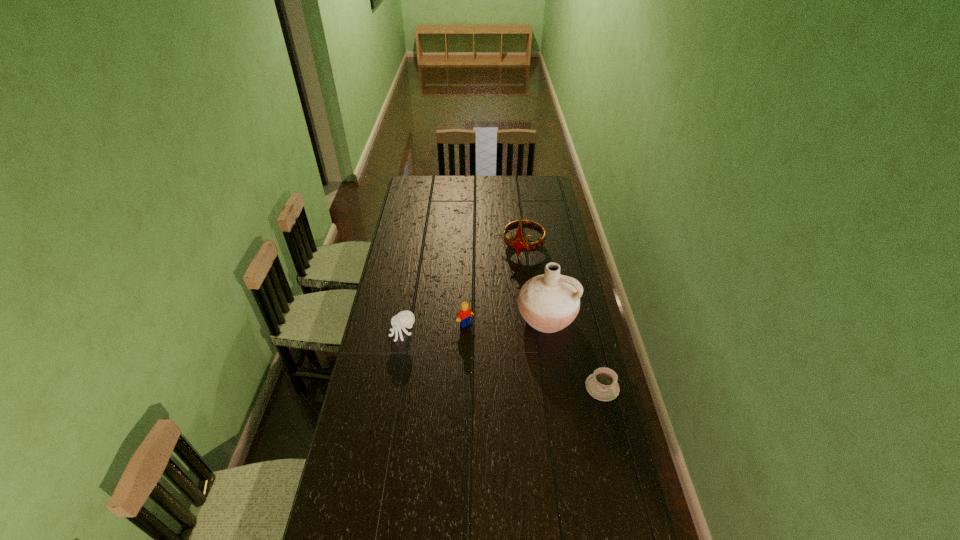
Where is `octopus`? This screenshot has height=540, width=960. octopus is located at coordinates (405, 319).

This screenshot has height=540, width=960. Identify the location of the shortest object. (602, 385).

You are a GUI agent. You are given a task and a screenshot of the screen. Output one action in this format:
    pyautogui.click(x=<x>, y=<y>)
    Task: Click on the teacup
    
    Given the screenshot: What is the action you would take?
    pyautogui.click(x=602, y=385)

Locate an element on the screen. This screenshot has width=960, height=540. Lego is located at coordinates (464, 316).

Find the location of `tiara`. tiara is located at coordinates (518, 243).

Locate an element on the screen. Image resolution: width=960 pixels, height=540 pixels. the farthest object is located at coordinates (518, 243).

The image size is (960, 540). Identify the location of pottery. (550, 302).

Find the location of a particular element. Image resolution: width=960 pixels, height=540 pixels. vacant region located on the front-facing side of the leftmost object is located at coordinates (377, 334).

This screenshot has height=540, width=960. I want to click on vacant region located on the handle side of the nearest object, so click(x=548, y=387).

At what (x,y) coordinates should I click in order to perform the action: click on vacant space located on the handle side of the nearest object. Please return your answer as a coordinate pair (x, y). Looking at the image, I should click on (518, 387).